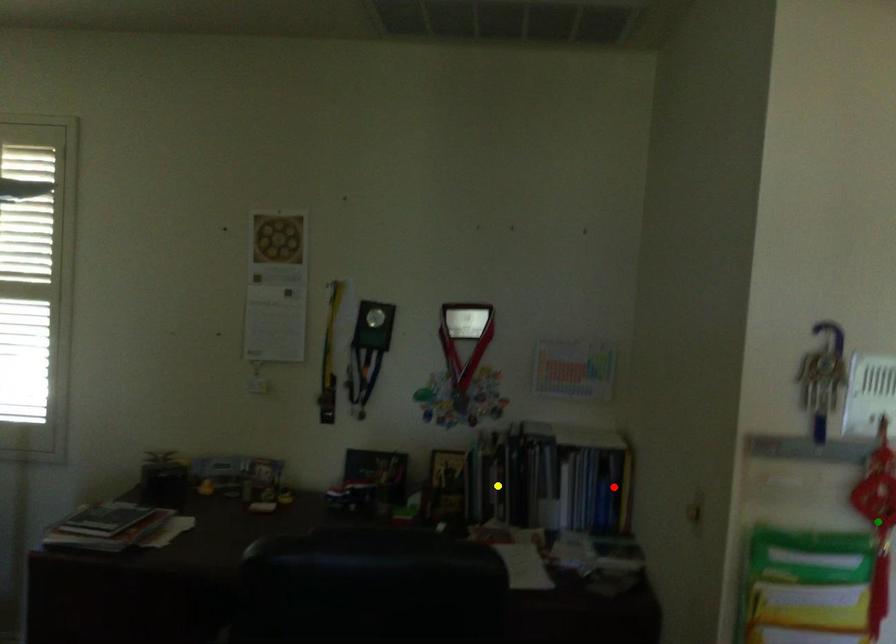
Order these from nearest to farthest:
1. red point
2. yellow point
3. green point

1. green point
2. red point
3. yellow point